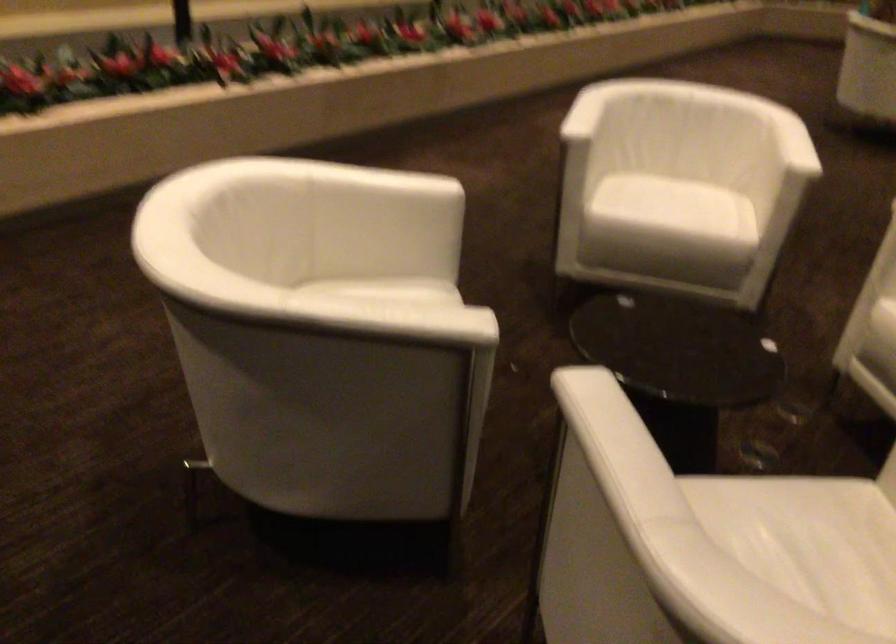
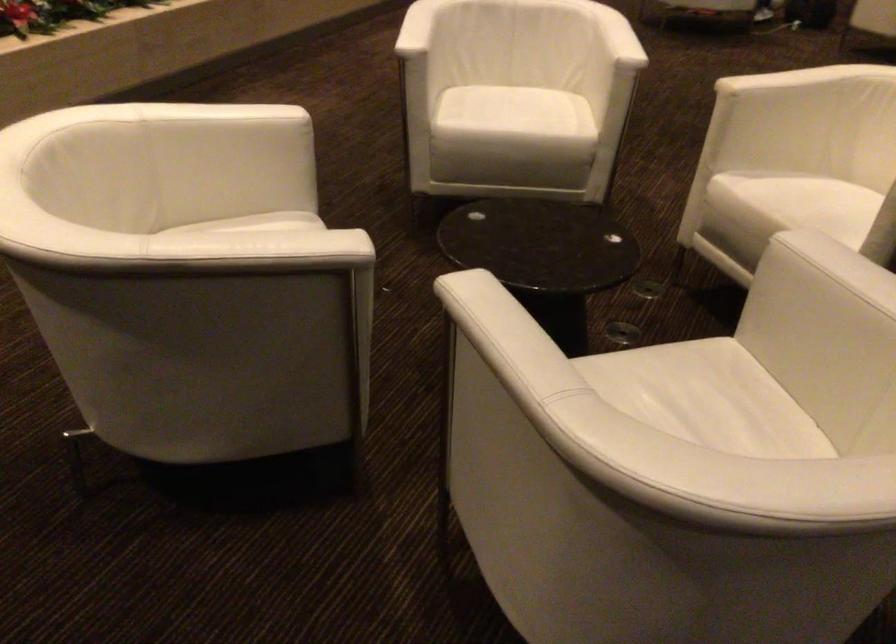
Where in the second image is the point corresponding to (681,207) from the first image?

(524, 117)